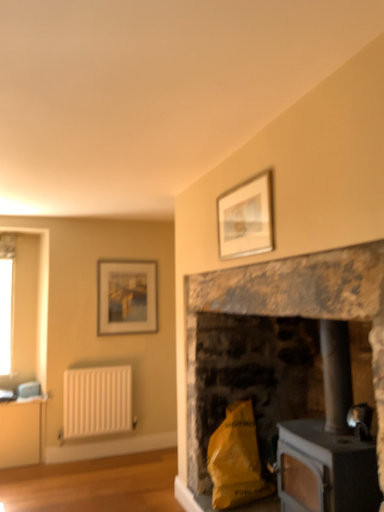
Question: Is yellow paper bag at lower center a part of black matte wood burning stove at lower right?

Choices:
 (A) no
 (B) yes

Answer: (A)

Question: Considering the relative positions of black matte wood burning stove at lower right and yellow paper bag at lower center in the image provided, is black matte wood burning stove at lower right to the right of yellow paper bag at lower center from the viewer's perspective?

Choices:
 (A) no
 (B) yes

Answer: (B)

Question: From the image's perspective, does black matte wood burning stove at lower right appear lower than yellow paper bag at lower center?

Choices:
 (A) yes
 (B) no

Answer: (B)

Question: Is black matte wood burning stove at lower right to the left of yellow paper bag at lower center from the viewer's perspective?

Choices:
 (A) yes
 (B) no

Answer: (B)

Question: Is black matte wood burning stove at lower right with yellow paper bag at lower center?

Choices:
 (A) no
 (B) yes

Answer: (A)

Question: From the image's perspective, is black matte wood burning stove at lower right on yellow paper bag at lower center?

Choices:
 (A) yes
 (B) no

Answer: (A)

Question: From a real-world perspective, is rustic stone fireplace at center positioned under black matte wood burning stove at lower right based on gravity?

Choices:
 (A) yes
 (B) no

Answer: (B)

Question: Is rustic stone fireplace at center not within black matte wood burning stove at lower right?

Choices:
 (A) yes
 (B) no

Answer: (A)

Question: Is rustic stone fireplace at center touching black matte wood burning stove at lower right?

Choices:
 (A) yes
 (B) no

Answer: (B)

Question: Considering the relative sizes of rustic stone fireplace at center and black matte wood burning stove at lower right in the image provided, is rustic stone fireplace at center smaller than black matte wood burning stove at lower right?

Choices:
 (A) no
 (B) yes

Answer: (A)

Question: Does rustic stone fireplace at center come in front of black matte wood burning stove at lower right?

Choices:
 (A) no
 (B) yes

Answer: (B)

Question: Considering the relative sizes of rustic stone fireplace at center and black matte wood burning stove at lower right in the image provided, is rustic stone fireplace at center bigger than black matte wood burning stove at lower right?

Choices:
 (A) yes
 (B) no

Answer: (A)

Question: Is rustic stone fireplace at center next to white textured radiator at left and touching it?

Choices:
 (A) yes
 (B) no

Answer: (B)